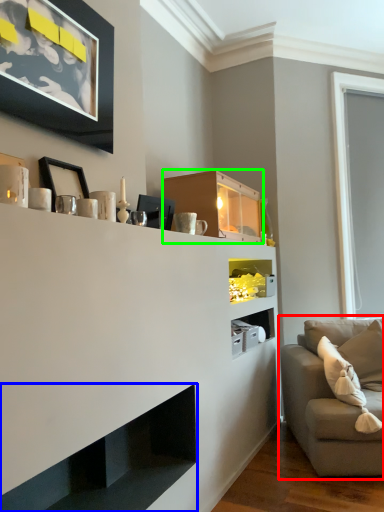
Question: Which object is positioned closest to studio couch (highlighted by a red box)? Select from shelf (highlighted by a blue box) and cabinet (highlighted by a green box).

Choices:
 (A) shelf
 (B) cabinet

Answer: (B)